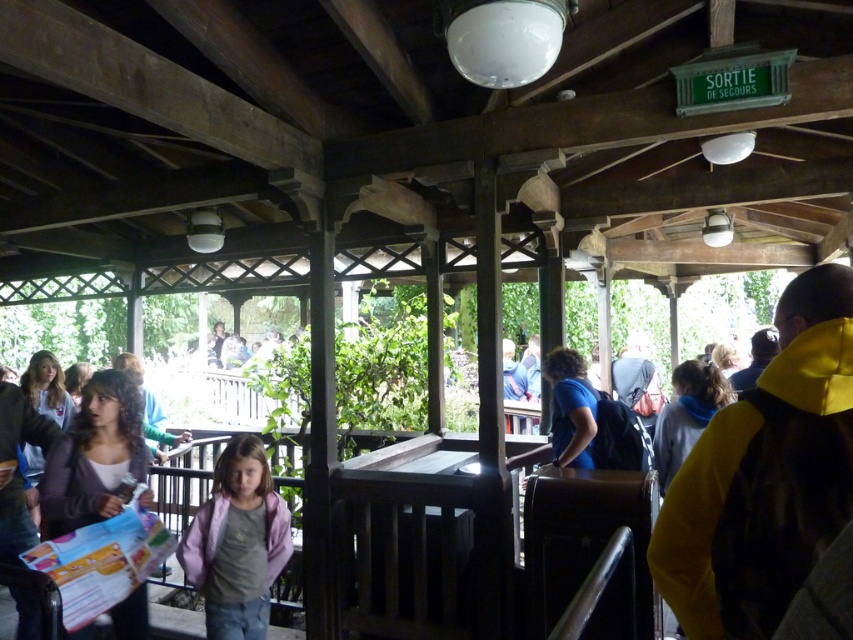
Question: Can you confirm if pink fabric jacket at center is thinner than matte gray sweater at left?

Choices:
 (A) no
 (B) yes

Answer: (A)

Question: Does matte gray sweater at left appear on the right side of gray fleece jacket at center?

Choices:
 (A) yes
 (B) no

Answer: (B)

Question: Estimate the real-world distances between objects in this image. Which object is closer to the matte gray sweater at left?

Choices:
 (A) yellow fleece jacket at right
 (B) gray fleece jacket at center
 (C) pink fabric jacket at center

Answer: (C)

Question: Does yellow fleece jacket at right have a greater width compared to gray fleece jacket at center?

Choices:
 (A) yes
 (B) no

Answer: (B)

Question: Which point is closer to the camera?

Choices:
 (A) yellow fleece jacket at right
 (B) pink fabric jacket at center
 (C) gray fleece jacket at center
 (D) matte gray sweater at left

Answer: (A)

Question: Which object appears farthest from the camera in this image?

Choices:
 (A) gray fleece jacket at center
 (B) matte gray sweater at left
 (C) pink fabric jacket at center
 (D) yellow fleece jacket at right

Answer: (A)